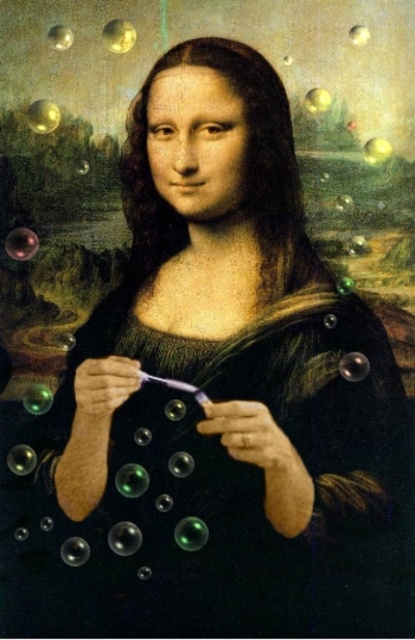
Which is above, metallic gold bubble at upper left or translucent glass bubble at upper left?

translucent glass bubble at upper left is above.

Consider the image. Can you confirm if metallic gold bubble at upper left is taller than translucent glass bubble at upper left?

Yes, metallic gold bubble at upper left is taller than translucent glass bubble at upper left.

You are a GUI agent. You are given a task and a screenshot of the screen. Output one action in this format:
    pyautogui.click(x=<x>, y=<y>)
    Task: Click on the metallic gold bubble at upper left
    Image resolution: width=415 pixels, height=640 pixels.
    Given the screenshot: What is the action you would take?
    pyautogui.click(x=43, y=116)

Between glossy glass bubble at upper left and translucent glass bubble at upper left, which one has more height?

glossy glass bubble at upper left is taller.

Does glossy glass bubble at upper left have a smaller size compared to translucent glass bubble at upper left?

Actually, glossy glass bubble at upper left might be larger than translucent glass bubble at upper left.

In the scene shown: Who is more forward, (17,240) or (107,26)?

Point (107,26) is more forward.

In order to click on glossy glass bubble at upper left in this screenshot , I will do `click(21, 243)`.

Does glossy glass bubble at upper left appear on the right side of transparent glass bubble at upper left?

In fact, glossy glass bubble at upper left is to the left of transparent glass bubble at upper left.

Which is in front, point (29, 230) or point (58, 49)?

Point (58, 49) is in front.

Which is behind, point (29, 252) or point (49, 29)?

Positioned behind is point (29, 252).

The width and height of the screenshot is (415, 640). In order to click on glossy glass bubble at upper left in this screenshot , I will do `click(21, 243)`.